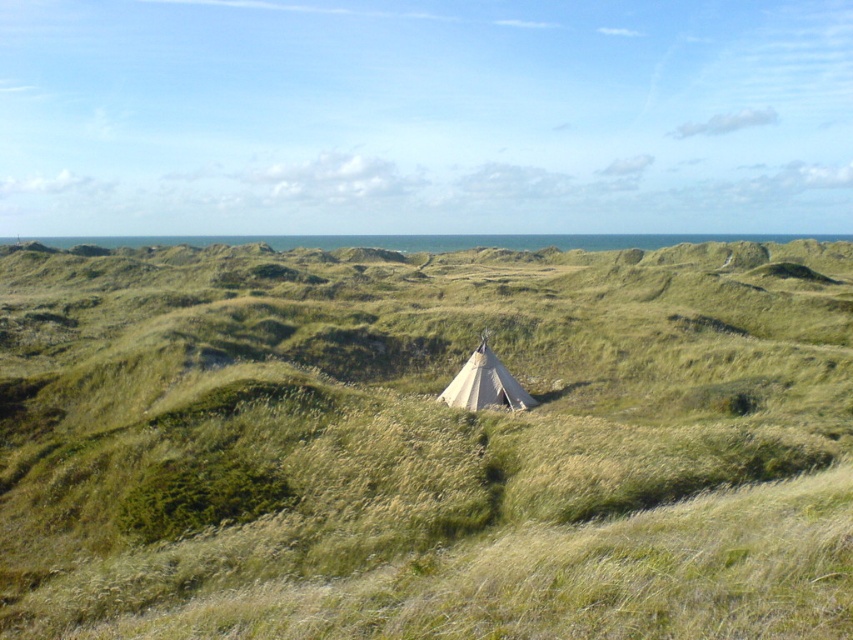
Question: Which object appears farthest from the camera in this image?

Choices:
 (A) beige canvas tent at center
 (B) green grassy at center

Answer: (A)

Question: Does green grassy at center come behind beige canvas tent at center?

Choices:
 (A) yes
 (B) no

Answer: (B)

Question: Is green grassy at center above beige canvas tent at center?

Choices:
 (A) yes
 (B) no

Answer: (A)

Question: From the image, what is the correct spatial relationship of green grassy at center in relation to beige canvas tent at center?

Choices:
 (A) left
 (B) right

Answer: (A)

Question: Which of the following is the closest to the observer?

Choices:
 (A) green grassy at center
 (B) beige canvas tent at center

Answer: (A)